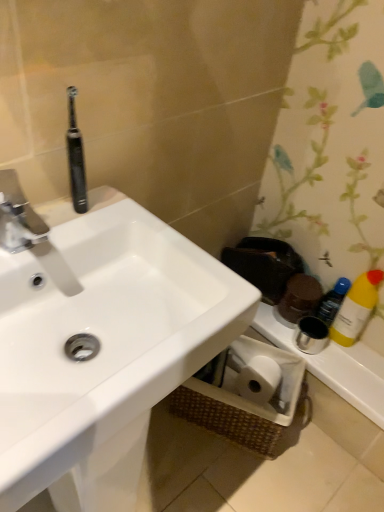
Locate an element on the screen. This screenshot has width=384, height=512. vacant space in front of blue plastic bottle at lower right is located at coordinates [x=351, y=365].